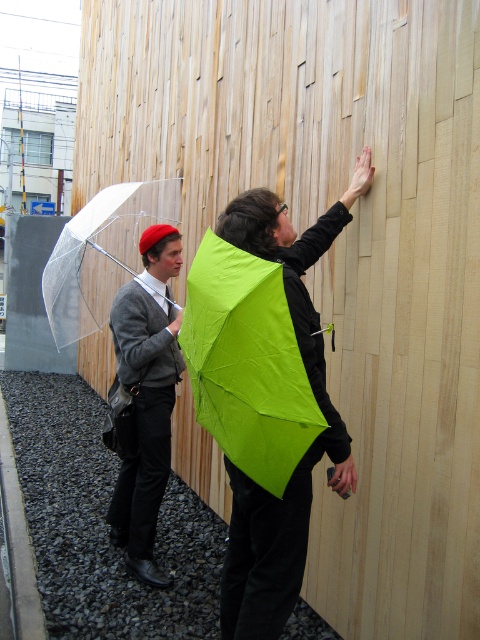
Question: Among these points, which one is farthest from the camera?

Choices:
 (A) (312, 416)
 (B) (84, 273)
 (C) (265, 195)

Answer: (B)

Question: Is lime green fabric umbrella at upper center smaller than matte gray sweater at center?

Choices:
 (A) yes
 (B) no

Answer: (A)

Question: In this image, where is matte green umbrella at center located relative to matte gray sweater at center?

Choices:
 (A) left
 (B) right

Answer: (B)

Question: Which of these objects is positioned closest to the matte green umbrella at center?

Choices:
 (A) lime green fabric umbrella at upper center
 (B) matte gray sweater at center
 (C) transparent plastic umbrella at left

Answer: (A)

Question: Can you confirm if matte green umbrella at center is positioned to the right of transparent plastic umbrella at left?

Choices:
 (A) no
 (B) yes

Answer: (B)

Question: Which point is closer to the camera taking this photo?

Choices:
 (A) (169, 257)
 (B) (308, 461)

Answer: (B)